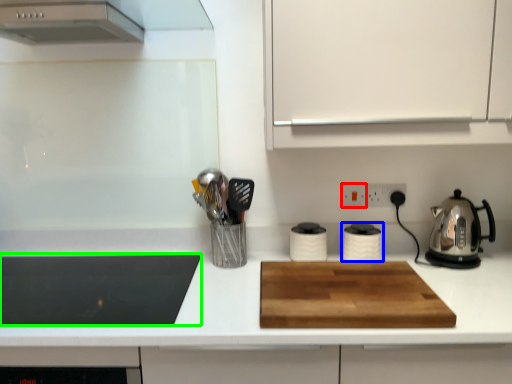
Question: Which object is positioned closest to electric outlet (highlighted by a red box)? Select from kitchen appliance (highlighted by a blue box) and kitchen appliance (highlighted by a green box).

Choices:
 (A) kitchen appliance
 (B) kitchen appliance

Answer: (A)